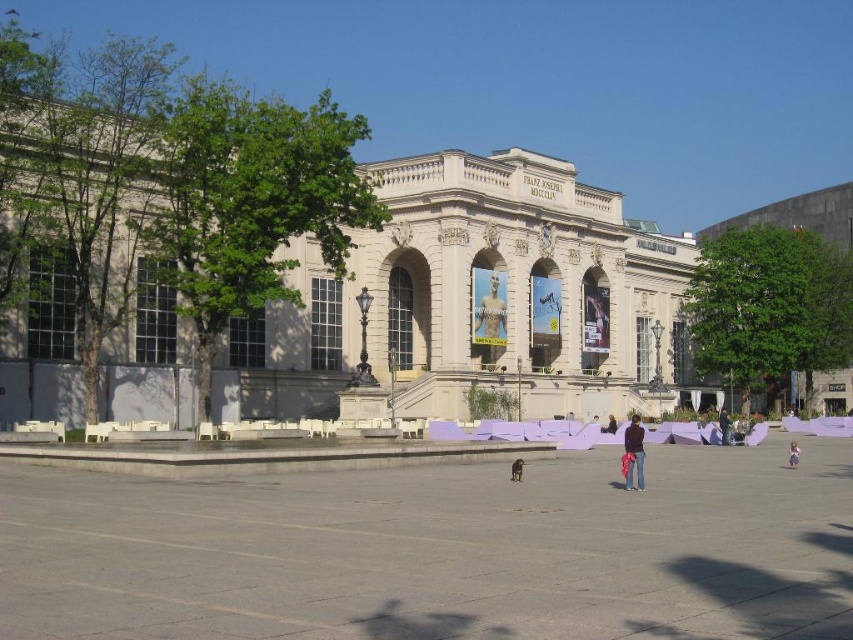
Between point (625, 438) and point (721, 428), which one is positioned behind?

The point (721, 428) is more distant.

Between point (642, 436) and point (721, 440), which one is positioned in front?

Point (642, 436)

At what (x,y) coordinates should I click in order to perform the action: click on purple cotton pants at center. Please return your answer as a coordinate pair (x, y). The height and width of the screenshot is (640, 853). Looking at the image, I should click on (634, 452).

Does purple cotton pants at center come in front of pink fabric at center?

That is True.

Does purple cotton pants at center have a lesser height compared to pink fabric at center?

No, purple cotton pants at center is not shorter than pink fabric at center.

Is point (630, 429) in front of point (798, 445)?

Yes.

Where is `purple cotton pants at center`? This screenshot has width=853, height=640. purple cotton pants at center is located at coordinates (634, 452).

Does smooth bronze statue at center appear on the left side of pink fabric at center?

Yes, smooth bronze statue at center is to the left of pink fabric at center.

Describe the element at coordinates (488, 307) in the screenshot. I see `smooth bronze statue at center` at that location.

Is point (474, 301) farther from viewer compared to point (796, 452)?

Yes, it is behind point (796, 452).

Where is `smooth bronze statue at center`? smooth bronze statue at center is located at coordinates (488, 307).